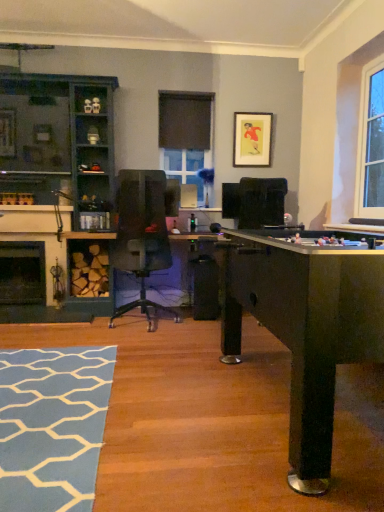
Question: Do you think black matte fireplace at lower left, which is the second fireplace in back-to-front order, is within transparent glass window screen at center, or outside of it?

Choices:
 (A) outside
 (B) inside

Answer: (A)

Question: Is black matte fireplace at lower left, which is the second fireplace in back-to-front order, taller or shorter than transparent glass window screen at center?

Choices:
 (A) short
 (B) tall

Answer: (B)

Question: Which is nearer to the black matte fireplace at lower left, placed as the 1th fireplace when sorted from front to back?

Choices:
 (A) teal wood cabinet at left
 (B) blue textured rug at lower left
 (C) matte gold picture frame at upper center
 (D) black stone fireplace at lower left, which is the first fireplace in back-to-front order
 (E) transparent glass window screen at center

Answer: (D)

Question: Considering the real-world distances, which object is closest to the transparent glass window screen at center?

Choices:
 (A) blue textured rug at lower left
 (B) black matte fireplace at lower left, which is the second fireplace in back-to-front order
 (C) matte gold picture frame at upper center
 (D) teal wood cabinet at left
 (E) black stone fireplace at lower left, which appears as the second fireplace when viewed from the front

Answer: (C)